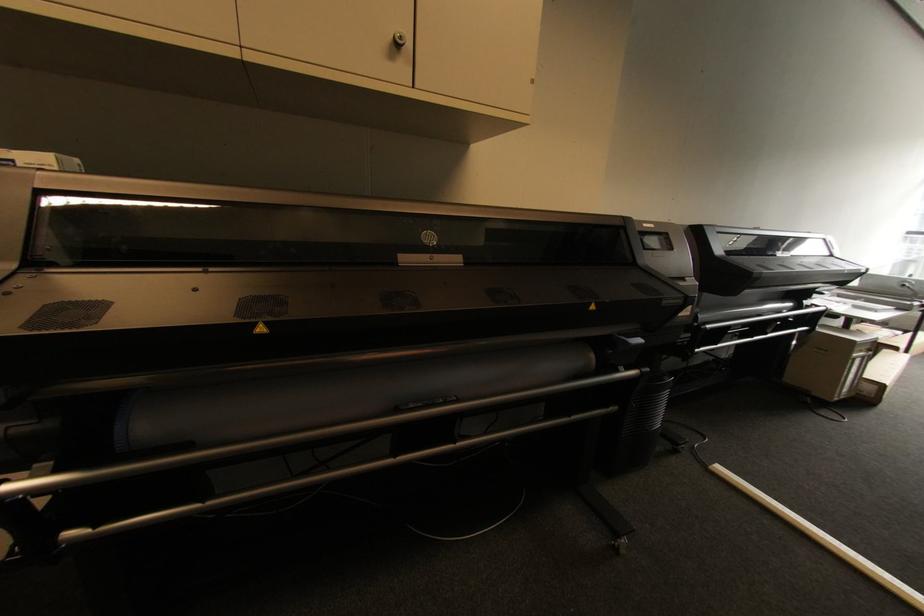
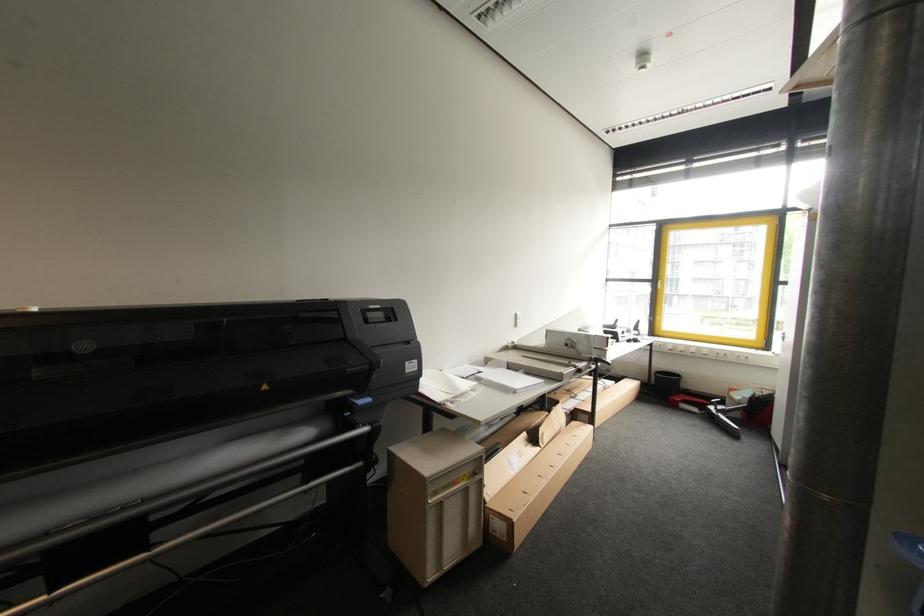
The point at (874,389) is marked in the first image. Where is the corresponding point in the second image?

(503, 527)